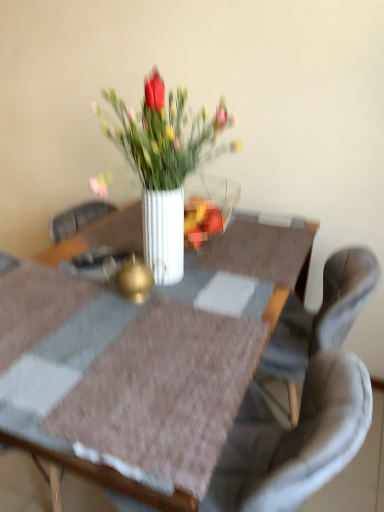
Question: From a real-world perspective, is white glossy vase at center under white glossy vase at center?

Choices:
 (A) no
 (B) yes

Answer: (B)

Question: From a real-world perspective, is white glossy vase at center positioned over white glossy vase at center based on gravity?

Choices:
 (A) no
 (B) yes

Answer: (A)

Question: Is white glossy vase at center at the left side of white glossy vase at center?

Choices:
 (A) no
 (B) yes

Answer: (B)

Question: Is white glossy vase at center wider than white glossy vase at center?

Choices:
 (A) no
 (B) yes

Answer: (B)

Question: Would you say white glossy vase at center contains white glossy vase at center?

Choices:
 (A) yes
 (B) no

Answer: (B)

Question: Is white glossy vase at center wider or thinner than white glossy vase at center?

Choices:
 (A) wide
 (B) thin

Answer: (B)

Question: Looking at the image, does white glossy vase at center seem bigger or smaller compared to white glossy vase at center?

Choices:
 (A) big
 (B) small

Answer: (B)

Question: Is white glossy vase at center to the left or to the right of white glossy vase at center in the image?

Choices:
 (A) right
 (B) left

Answer: (A)

Question: From the image's perspective, relative to white glossy vase at center, is white glossy vase at center above or below?

Choices:
 (A) below
 (B) above

Answer: (B)

Question: Considering their positions, is gray fabric chair at center located in front of or behind white glossy vase at center?

Choices:
 (A) behind
 (B) front

Answer: (A)

Question: From the image's perspective, is gray fabric chair at center positioned above or below white glossy vase at center?

Choices:
 (A) below
 (B) above

Answer: (A)

Question: Is gray fabric chair at center inside the boundaries of white glossy vase at center, or outside?

Choices:
 (A) inside
 (B) outside

Answer: (A)

Question: Looking at their shapes, would you say gray fabric chair at center is wider or thinner than white glossy vase at center?

Choices:
 (A) wide
 (B) thin

Answer: (B)

Question: Is point (201, 232) positioned closer to the camera than point (311, 373)?

Choices:
 (A) farther
 (B) closer

Answer: (A)

Question: From the image's perspective, is white glossy vase at center above or below gray fabric chair at center?

Choices:
 (A) below
 (B) above

Answer: (B)